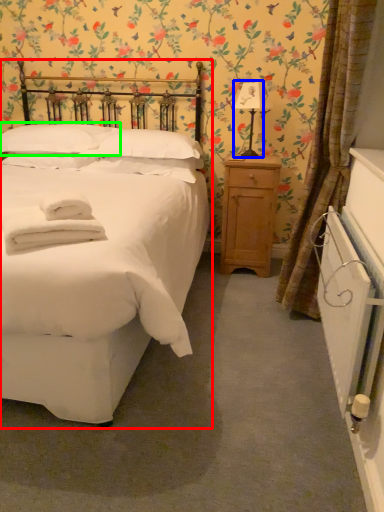
Question: Which is farther away from bed (highlighted by a red box)? table lamp (highlighted by a blue box) or pillow (highlighted by a green box)?

Choices:
 (A) table lamp
 (B) pillow

Answer: (A)